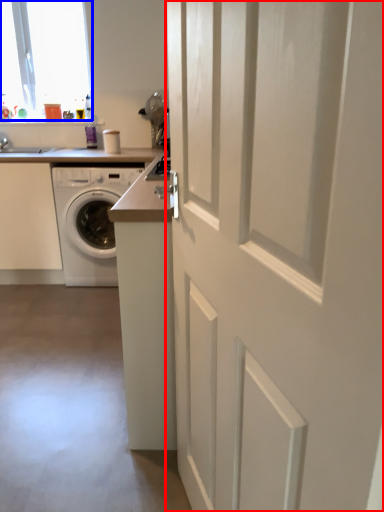
Question: Which of the following is the closest to the observer, door (highlighted by a red box) or window (highlighted by a blue box)?

Choices:
 (A) door
 (B) window

Answer: (A)